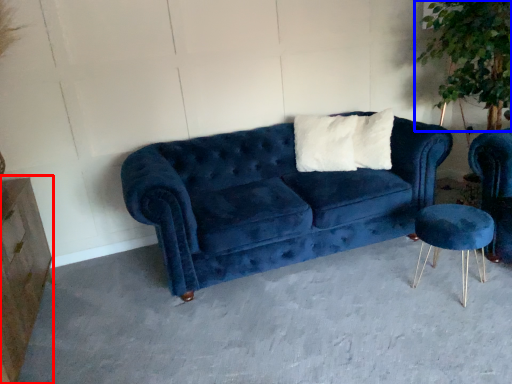
Question: Which of the following is the farthest to the observer, dresser (highlighted by a red box) or plant (highlighted by a blue box)?

Choices:
 (A) dresser
 (B) plant

Answer: (B)